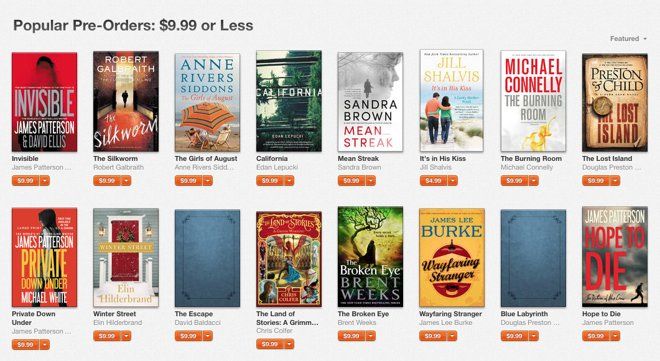
Identify the location of books in the bottom row. (32, 247), (123, 258), (211, 257), (286, 253), (373, 257), (472, 263), (548, 271), (616, 258).